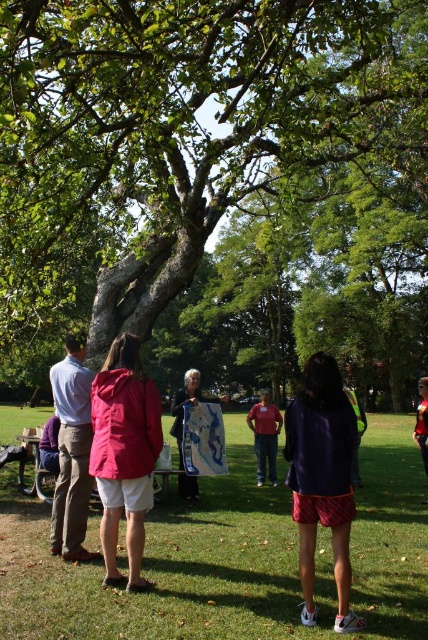
Can you confirm if light blue shirt at left is positioned below matte blue map at center?

No.

Does light blue shirt at left have a greater width compared to matte blue map at center?

Incorrect, light blue shirt at left's width does not surpass matte blue map at center's.

Does point (62, 534) come farther from viewer compared to point (184, 396)?

That is False.

Locate an element on the screen. This screenshot has height=640, width=428. light blue shirt at left is located at coordinates (71, 451).

Image resolution: width=428 pixels, height=640 pixels. I want to click on green rough bark tree at center, so click(216, 186).

Can you confirm if green rough bark tree at center is smaller than dark blue jacket at center?

Incorrect, green rough bark tree at center is not smaller in size than dark blue jacket at center.

Is point (53, 289) positioned behind point (309, 376)?

That is True.

At what (x,y) coordinates should I click in order to perform the action: click on green rough bark tree at center. Please return your answer as a coordinate pair (x, y). The image size is (428, 640). Looking at the image, I should click on (216, 186).

Who is taller, green grass at center or red fabric jacket at center?

With more height is red fabric jacket at center.

Which is above, green grass at center or red fabric jacket at center?

green grass at center is above.

Is point (35, 588) less distant than point (419, 378)?

Yes, it is.

The height and width of the screenshot is (640, 428). In order to click on green grass at center in this screenshot , I will do `click(232, 560)`.